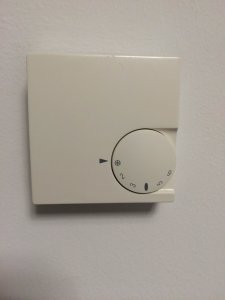
Where is `wall on the right`? wall on the right is located at coordinates (199, 139).